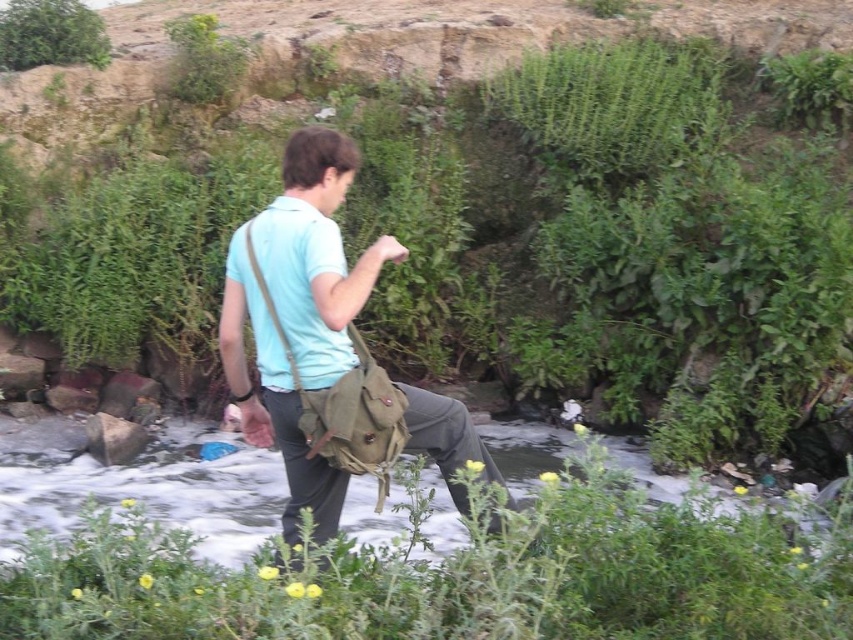
Question: Estimate the real-world distances between objects in this image. Which object is farther from the green leafy bush at upper left?

Choices:
 (A) light blue cotton shirt at center
 (B) green leafy plants at center
 (C) green leafy plant at center

Answer: (C)

Question: Which of the following is the farthest from the observer?

Choices:
 (A) (694, 556)
 (B) (310, 260)
 (C) (82, 301)

Answer: (C)

Question: In this image, where is green leafy plants at center located relative to light blue cotton shirt at center?

Choices:
 (A) right
 (B) left

Answer: (A)

Question: Which of the following is the closest to the observer?

Choices:
 (A) (746, 298)
 (B) (596, 582)
 (C) (3, 26)
 (D) (328, 380)

Answer: (B)

Question: Where is green leafy plants at center located in relation to green leafy plant at center in the image?

Choices:
 (A) above
 (B) below

Answer: (A)

Question: Where is green leafy plants at center located in relation to light blue cotton shirt at center in the image?

Choices:
 (A) below
 (B) above

Answer: (B)